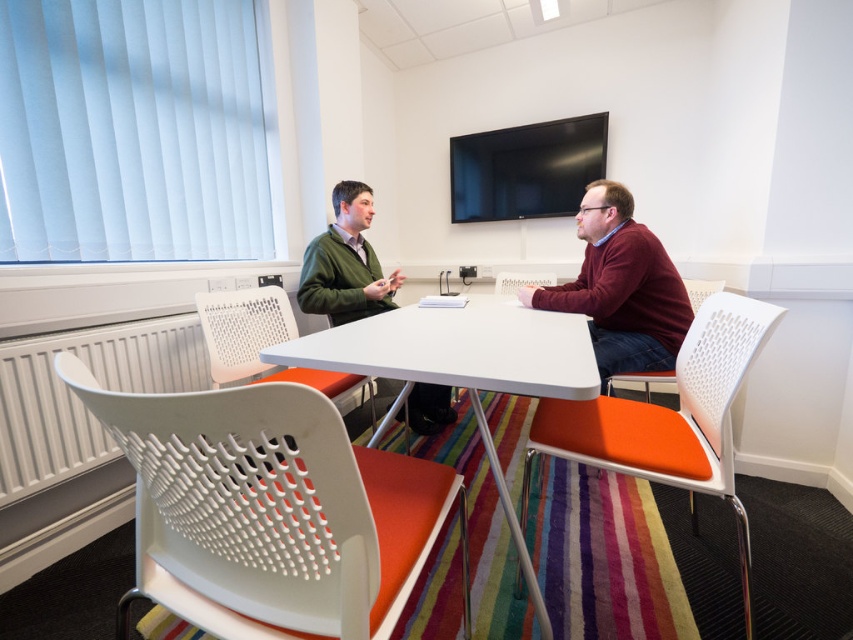
Does white glossy table at center appear on the right side of white perforated chair at center?

Incorrect, white glossy table at center is not on the right side of white perforated chair at center.

Looking at this image, which is more to the left, white glossy table at center or white perforated chair at center?

white glossy table at center is more to the left.

Which is behind, point (468, 353) or point (534, 276)?

The point (534, 276) is more distant.

Where is `white glossy table at center`? This screenshot has height=640, width=853. white glossy table at center is located at coordinates (463, 369).

Does white plastic radiator at lower left appear on the left side of white perforated chair at right?

Yes, white plastic radiator at lower left is to the left of white perforated chair at right.

Is white plastic radiator at lower left wider than white perforated chair at right?

Incorrect, white plastic radiator at lower left's width does not surpass white perforated chair at right's.

Which is in front, point (155, 344) or point (706, 289)?

Point (155, 344)

At what (x,y) coordinates should I click in order to perform the action: click on white plastic radiator at lower left. Please return your answer as a coordinate pair (x, y). Looking at the image, I should click on (78, 400).

Does white plastic chair at lower left appear on the left side of green matte sweater at center?

In fact, white plastic chair at lower left is to the right of green matte sweater at center.

Who is more forward, (223, 604) or (315, 308)?

Positioned in front is point (223, 604).

Image resolution: width=853 pixels, height=640 pixels. Find the location of `white plastic chair at lower left`. white plastic chair at lower left is located at coordinates (270, 512).